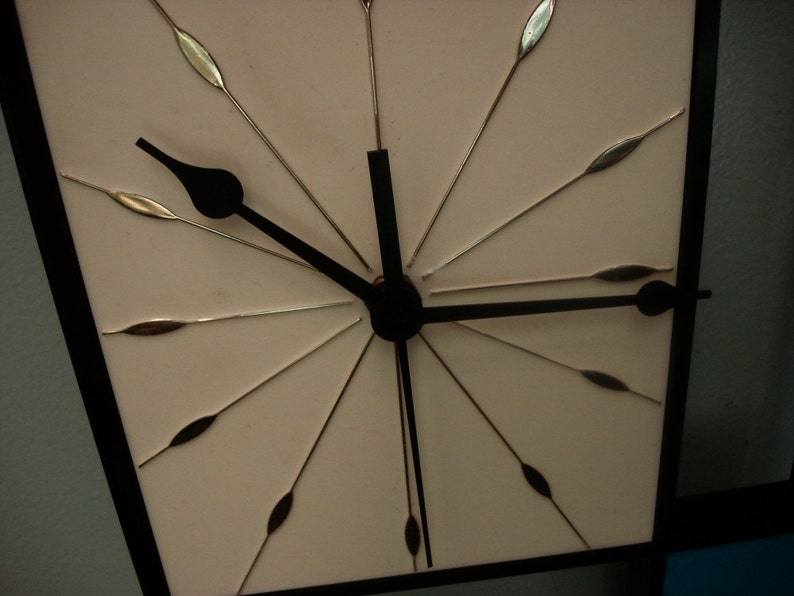
What are the coordinates of `black clock hand` in the screenshot? It's located at (216, 193), (656, 301).